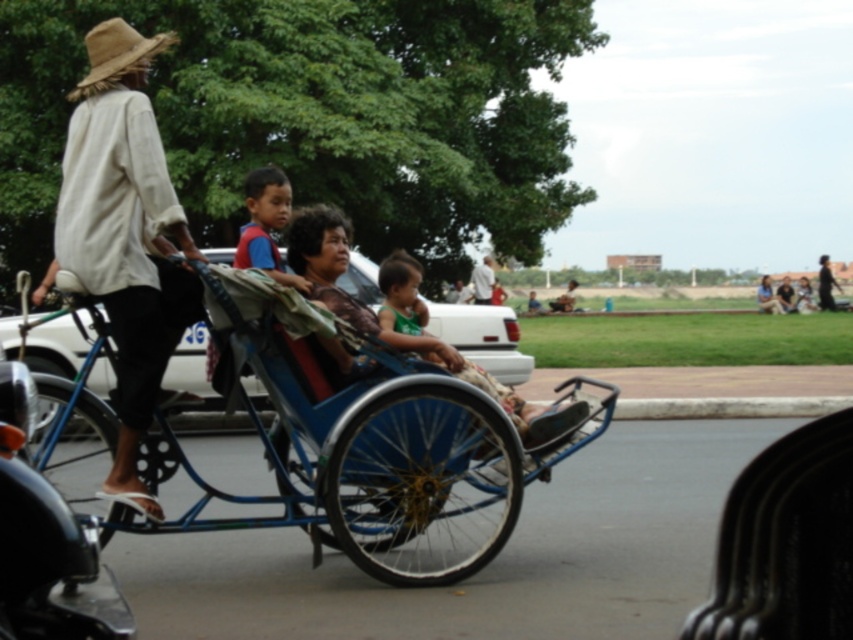
Question: Among these objects, which one is farthest from the camera?

Choices:
 (A) dark blue fabric jacket at center
 (B) blue metallic cart at center
 (C) natural straw hat at upper left
 (D) green fabric baby carriage at center

Answer: (A)

Question: Is light beige cotton shirt at left thinner than white cotton shirt at upper center?

Choices:
 (A) no
 (B) yes

Answer: (B)

Question: Based on their relative distances, which object is nearer to the blue metallic cart at center?

Choices:
 (A) dark blue fabric jacket at center
 (B) light beige cotton shirt at left
 (C) white cotton shirt at upper center
 (D) natural straw hat at upper left

Answer: (B)

Question: Among these points, which one is nearest to the camera?

Choices:
 (A) (822, 298)
 (B) (550, 460)

Answer: (B)

Question: Does green fabric baby carriage at center come in front of dark blue fabric jacket at center?

Choices:
 (A) no
 (B) yes

Answer: (B)

Question: Is blue metallic cart at center positioned behind natural straw hat at upper left?

Choices:
 (A) yes
 (B) no

Answer: (B)